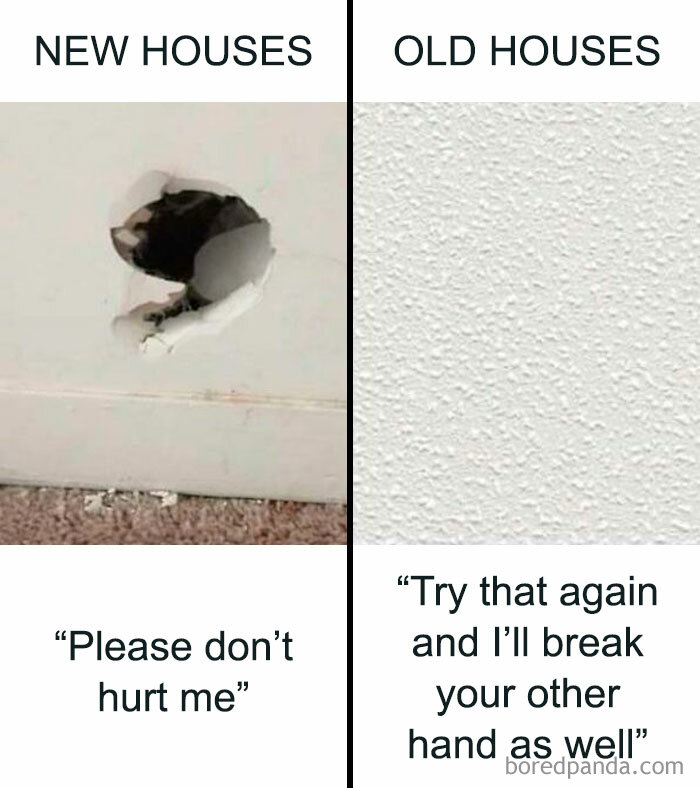
The width and height of the screenshot is (700, 788). In order to click on moulding in this screenshot , I will do `click(22, 426)`, `click(92, 443)`, `click(161, 447)`, `click(232, 448)`, `click(304, 456)`.